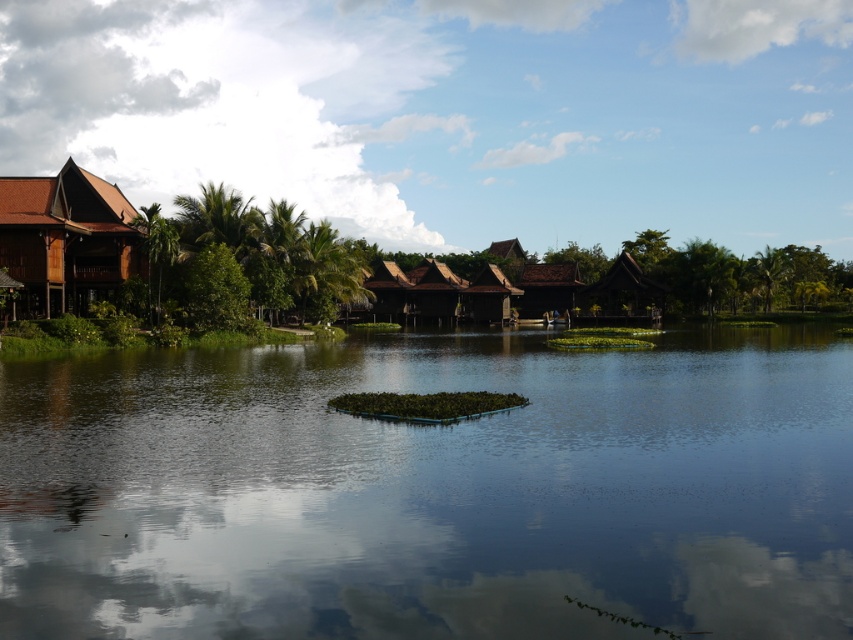
Who is more forward, (78, 260) or (601, 307)?

Point (78, 260)

Can you confirm if matte brown wooden hut at left is thinner than brown wooden hut at center-right?

No.

Is point (74, 227) positioned before point (631, 259)?

Yes, it is.

The image size is (853, 640). Identify the location of matte brown wooden hut at left. (67, 236).

Measure the distance from transparent water at center to brown wooden hut at center-right.

transparent water at center and brown wooden hut at center-right are 63.87 meters apart from each other.

Does transparent water at center lie in front of brown wooden hut at center-right?

That is True.

The width and height of the screenshot is (853, 640). In order to click on transparent water at center in this screenshot , I will do `click(431, 490)`.

Where is `transparent water at center`? Image resolution: width=853 pixels, height=640 pixels. transparent water at center is located at coordinates (431, 490).

Between transparent water at center and matte brown wooden hut at left, which one is positioned lower?

Positioned lower is transparent water at center.

Is transparent water at center to the right of matte brown wooden hut at left from the viewer's perspective?

Correct, you'll find transparent water at center to the right of matte brown wooden hut at left.

Where is `transparent water at center`? transparent water at center is located at coordinates (431, 490).